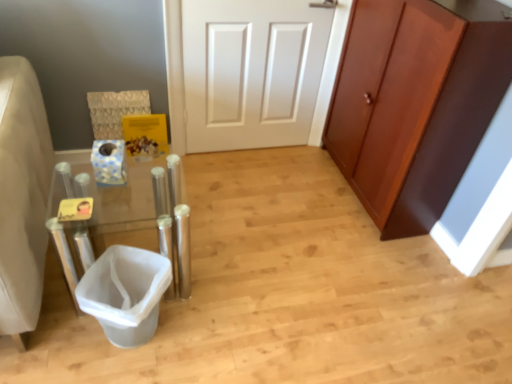
The width and height of the screenshot is (512, 384). In order to click on vacant area that is situated to the right of clear acrylic vanity at left in this screenshot , I will do `click(225, 298)`.